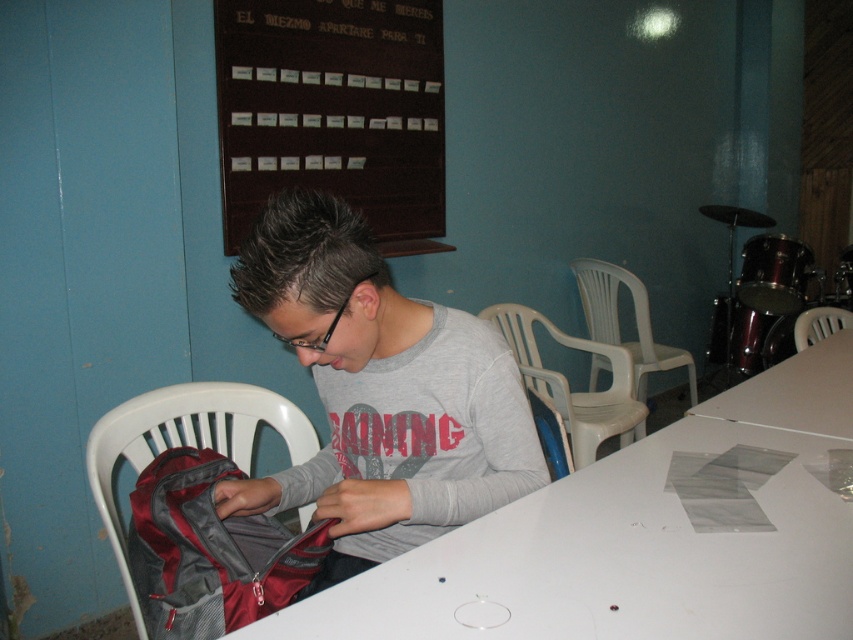
From the picture: Based on the scene, where is the wooden plaque at upper center located in the image?

The wooden plaque at upper center is located at point coordinates of 0.175 in the x axis and 0.392 in the y axis.

You are an interior designer planning to place a new rectangular shelf in the room. The shelf must be placed between the gray matte shirt at center and the white matte table at lower right. Which object should the shelf be placed closer to if the shelf has a width of 1 meter?

The shelf should be placed closer to the gray matte shirt at center because it is thinner than the white matte table at lower right, so the shirt requires less space and the shelf can fit closer to it while still accommodating both objects.